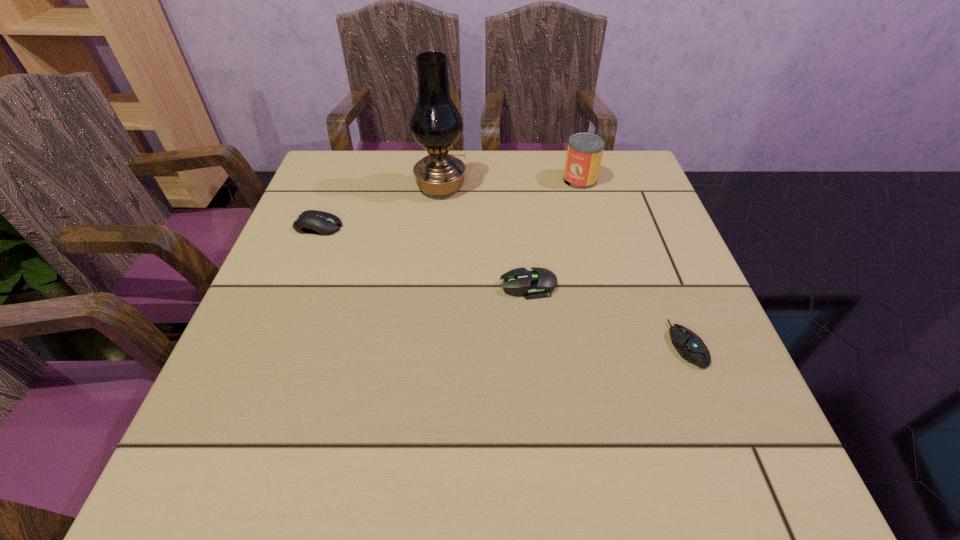
This screenshot has width=960, height=540. I want to click on oil lamp, so click(x=435, y=123).

The height and width of the screenshot is (540, 960). Find the location of `the tallest object`. the tallest object is located at coordinates (435, 123).

This screenshot has width=960, height=540. Identify the location of the second object from right to left. (584, 153).

Find the location of a particular element. the fourth shortest object is located at coordinates (584, 153).

At what (x,y) coordinates should I click in order to perform the action: click on the farthest computer mouse. Please return your answer as a coordinate pair (x, y). This screenshot has height=540, width=960. Looking at the image, I should click on (316, 222).

At what (x,y) coordinates should I click in order to perform the action: click on the third shortest object. Please return your answer as a coordinate pair (x, y). This screenshot has height=540, width=960. Looking at the image, I should click on pos(316,222).

Identify the location of the fourth farthest object. (538, 283).

The height and width of the screenshot is (540, 960). I want to click on the third object from right to left, so click(x=538, y=283).

Identify the location of the nearest computer mouse. The height and width of the screenshot is (540, 960). (690, 346).

You are a GUI agent. You are given a task and a screenshot of the screen. Output one action in this format:
    pyautogui.click(x=<x>, y=<y>)
    Task: Click on the nearest object
    
    Given the screenshot: What is the action you would take?
    pyautogui.click(x=690, y=346)